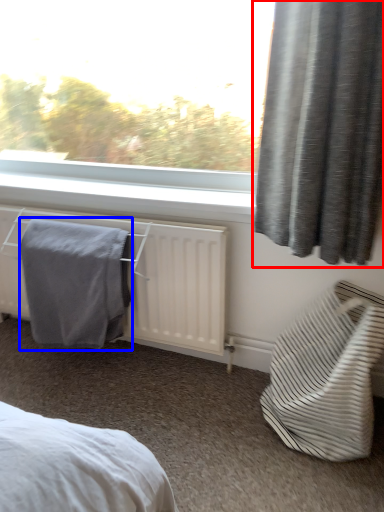
Question: Which object is further to the camera taking this photo, curtain (highlighted by a red box) or bath towel (highlighted by a blue box)?

Choices:
 (A) curtain
 (B) bath towel

Answer: (B)